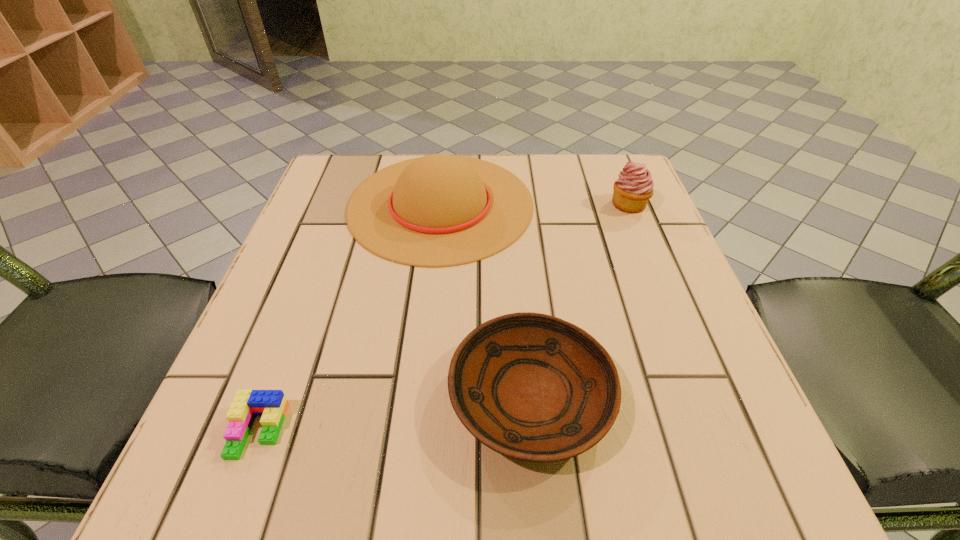
Where is `plate that is at the near edge`? plate that is at the near edge is located at coordinates (532, 387).

Identify the location of Lego present at the near edge. The height and width of the screenshot is (540, 960). (271, 405).

Locate an element on the screen. Image resolution: width=960 pixels, height=540 pixels. sombrero present at the left edge is located at coordinates (440, 210).

You are a GUI agent. You are given a task and a screenshot of the screen. Output one action in this format:
    pyautogui.click(x=<x>, y=<y>)
    Task: Click on the Lego that is at the left edge
    
    Given the screenshot: What is the action you would take?
    pyautogui.click(x=271, y=405)

Where is `object that is at the right edge`? object that is at the right edge is located at coordinates (631, 192).

Identify the location of object present at the far left corner. This screenshot has height=540, width=960. [440, 210].

This screenshot has height=540, width=960. Identify the location of object that is positioned at the near left corner. (271, 405).

Where is `object present at the far right corner`? This screenshot has width=960, height=540. object present at the far right corner is located at coordinates (631, 192).

In order to click on vacant space at the far edge of the desktop in this screenshot , I will do `click(517, 168)`.

The height and width of the screenshot is (540, 960). I want to click on free space at the near edge, so click(x=462, y=437).